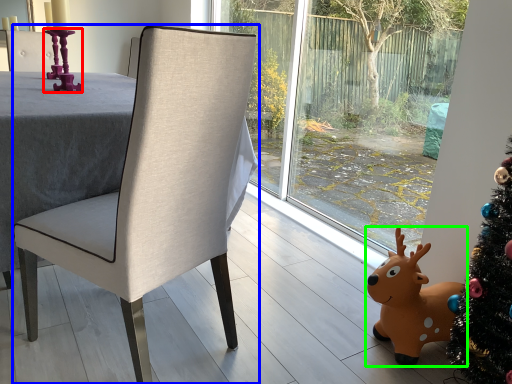
Question: Estimate the real-world distances between objects in this image. Which object is closer to candle holder (highlighted by a red box), chair (highlighted by a blue box) or deer (highlighted by a green box)?

Choices:
 (A) chair
 (B) deer

Answer: (A)